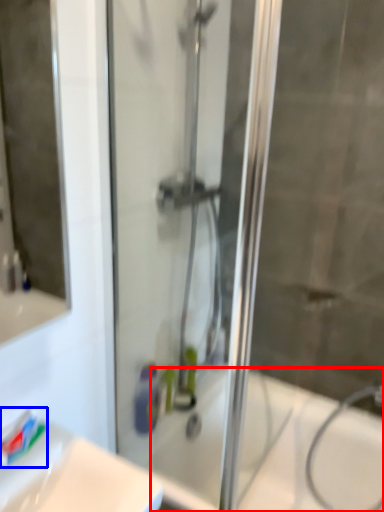
Question: Among these objects, which one is farthest to the camera, bath (highlighted by a red box) or toothpaste (highlighted by a blue box)?

Choices:
 (A) bath
 (B) toothpaste

Answer: (A)